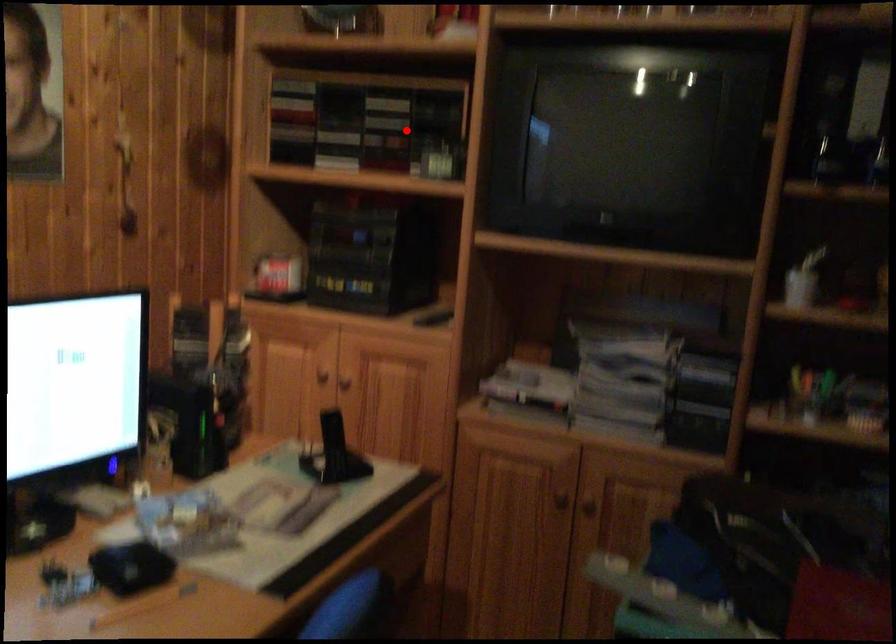
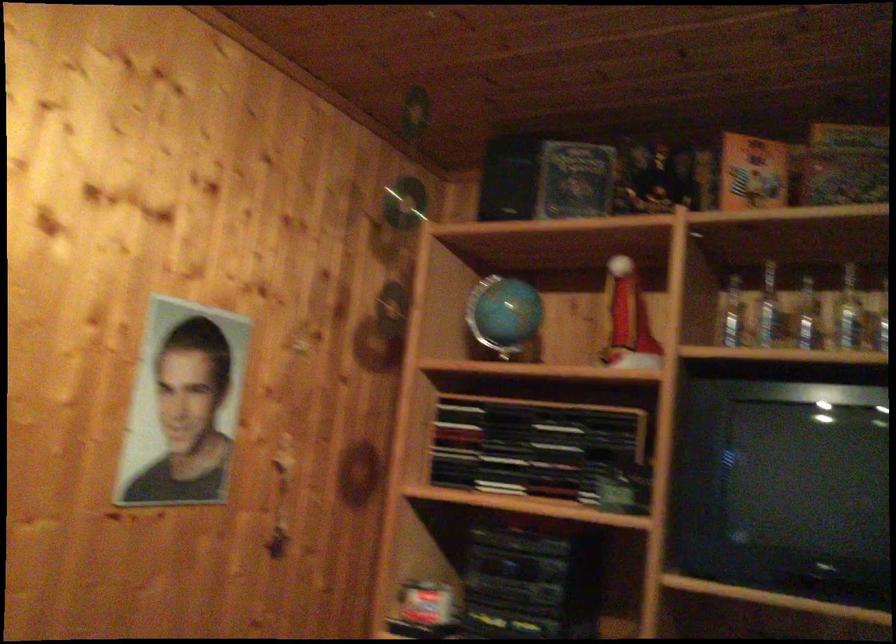
Where in the second image is the point corresponding to the highlighted location from the first image?

(573, 446)